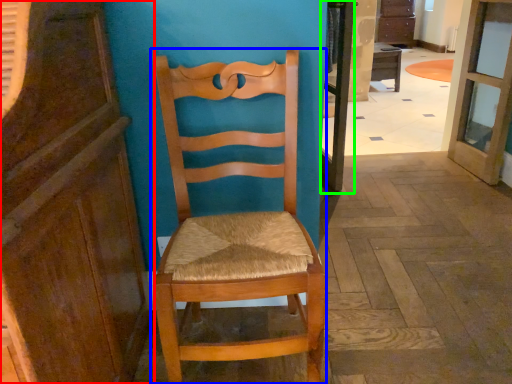
Question: Based on their relative distances, which object is nearer to cabinetry (highlighted by a red box)? Choose from chair (highlighted by a blue box) and screen door (highlighted by a green box).

Choices:
 (A) chair
 (B) screen door

Answer: (A)